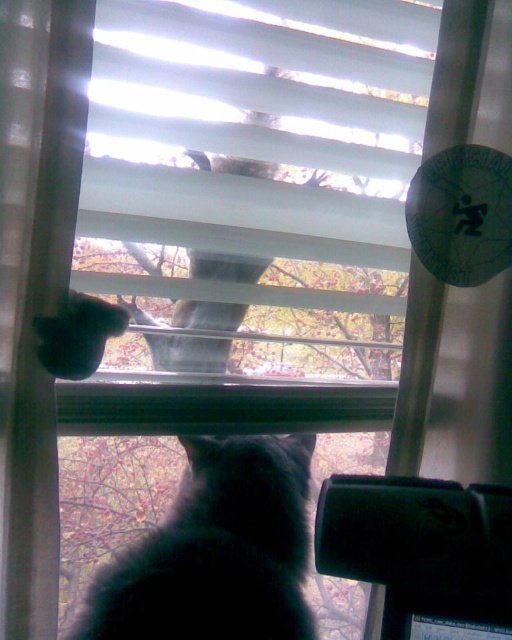
Question: Does white matte blinds at upper center have a larger size compared to fuzzy gray cat at upper center?

Choices:
 (A) no
 (B) yes

Answer: (B)

Question: Which point appears farthest from the camera in this image?

Choices:
 (A) (211, 532)
 (B) (263, 74)

Answer: (B)

Question: Which point is closer to the camera?

Choices:
 (A) (311, 193)
 (B) (89, 621)
 (C) (227, 160)

Answer: (B)

Question: Considering the relative positions of white matte blinds at upper center and black fluffy cat at lower center in the image provided, where is white matte blinds at upper center located with respect to black fluffy cat at lower center?

Choices:
 (A) below
 (B) above

Answer: (B)

Question: Does white matte blinds at upper center have a lesser width compared to fuzzy gray cat at upper center?

Choices:
 (A) no
 (B) yes

Answer: (A)

Question: Which of the following is the farthest from the observer?

Choices:
 (A) white matte blinds at upper center
 (B) fuzzy gray cat at upper center
 (C) black fluffy cat at lower center

Answer: (B)